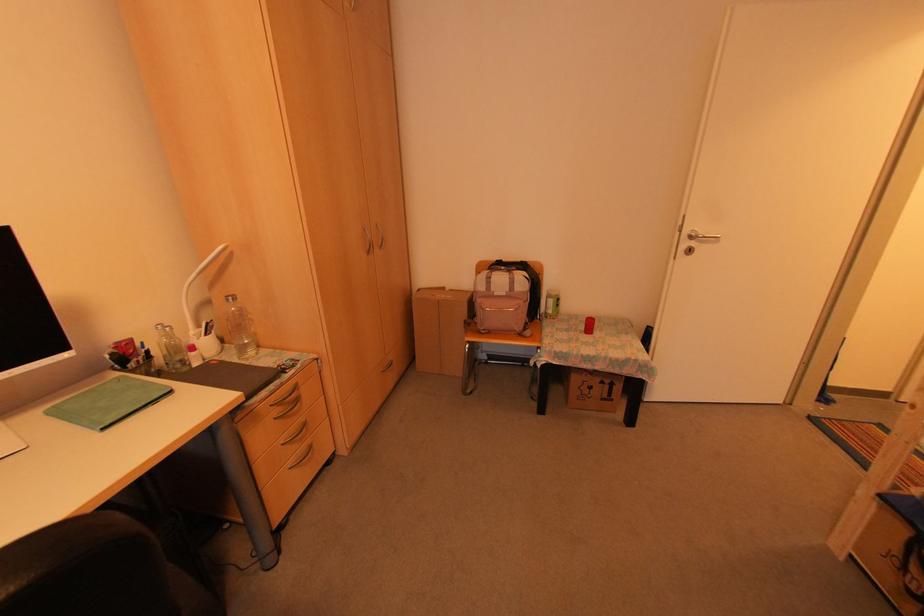
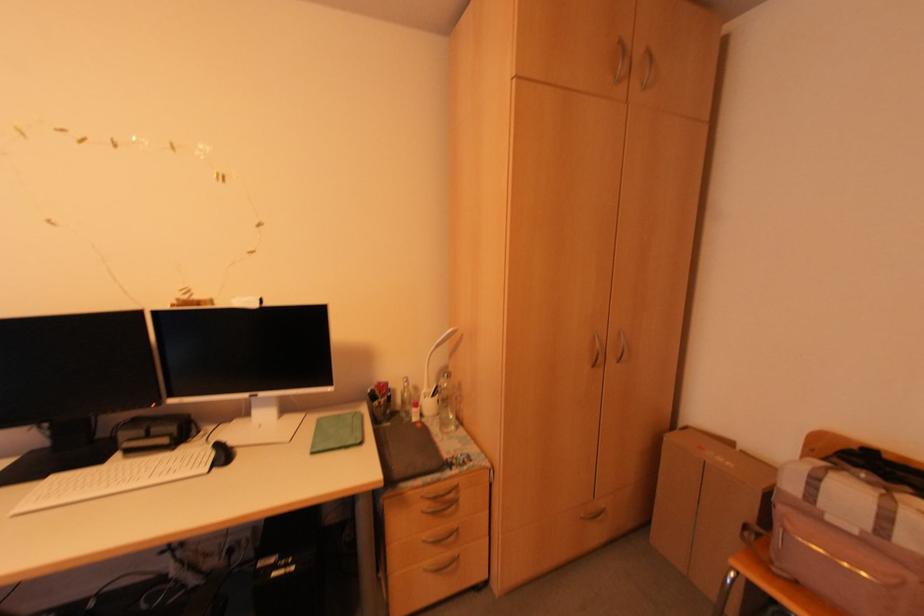
In the second image, find the point that corresponds to [502,294] in the first image.

(854, 532)